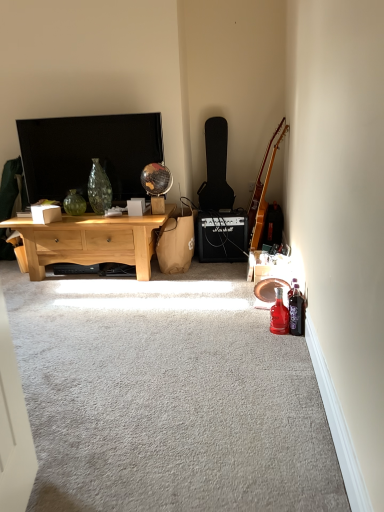
Question: Is brown paper bag at center touching green glass vase at center?

Choices:
 (A) no
 (B) yes

Answer: (A)

Question: Does brown paper bag at center have a lesser width compared to green glass vase at center?

Choices:
 (A) no
 (B) yes

Answer: (A)

Question: Is the depth of brown paper bag at center greater than that of green glass vase at center?

Choices:
 (A) no
 (B) yes

Answer: (A)

Question: Is brown paper bag at center not within green glass vase at center?

Choices:
 (A) no
 (B) yes

Answer: (B)

Question: From a real-world perspective, does brown paper bag at center sit lower than green glass vase at center?

Choices:
 (A) yes
 (B) no

Answer: (A)

Question: Considering the relative positions of white cardboard box at center, the 2th box viewed from the right, and translucent purple bottle at lower right, which is counted as the 1th bottle, starting from the right, in the image provided, is white cardboard box at center, the 2th box viewed from the right, to the left or to the right of translucent purple bottle at lower right, which is counted as the 1th bottle, starting from the right,?

Choices:
 (A) left
 (B) right

Answer: (A)

Question: Is white cardboard box at center, the first box in the left-to-right sequence, taller or shorter than translucent purple bottle at lower right, the 2th bottle when ordered from left to right?

Choices:
 (A) short
 (B) tall

Answer: (A)

Question: Choose the correct answer: Is white cardboard box at center, the first box in the left-to-right sequence, inside translucent purple bottle at lower right, the 2th bottle when ordered from left to right, or outside it?

Choices:
 (A) outside
 (B) inside

Answer: (A)

Question: Considering the positions of point (46, 220) and point (301, 323), is point (46, 220) closer or farther from the camera than point (301, 323)?

Choices:
 (A) farther
 (B) closer

Answer: (A)

Question: From a real-world perspective, is green glass vase at center above or below matte black tv at upper left?

Choices:
 (A) above
 (B) below

Answer: (B)

Question: In terms of height, does green glass vase at center look taller or shorter compared to matte black tv at upper left?

Choices:
 (A) tall
 (B) short

Answer: (B)

Question: Is point (62, 202) closer or farther from the camera than point (139, 150)?

Choices:
 (A) farther
 (B) closer

Answer: (A)

Question: Relative to matte black tv at upper left, is green glass vase at center in front or behind?

Choices:
 (A) front
 (B) behind

Answer: (B)

Question: Considering the positions of brown paper bag at center and matte black tv at upper left in the image, is brown paper bag at center wider or thinner than matte black tv at upper left?

Choices:
 (A) wide
 (B) thin

Answer: (A)

Question: From a real-world perspective, relative to matte black tv at upper left, is brown paper bag at center vertically above or below?

Choices:
 (A) below
 (B) above

Answer: (A)